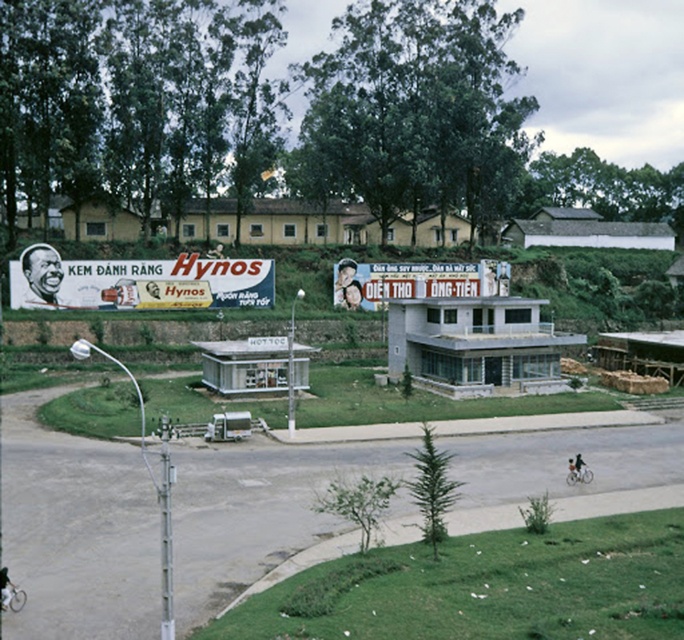
Question: Does matte yellow billboard at left appear under matte plastic billboard at center?

Choices:
 (A) yes
 (B) no

Answer: (A)

Question: Among these objects, which one is nearest to the camera?

Choices:
 (A) matte plastic billboard at center
 (B) matte yellow billboard at left

Answer: (B)

Question: Can you confirm if matte yellow billboard at left is bigger than matte plastic billboard at center?

Choices:
 (A) yes
 (B) no

Answer: (A)

Question: Which point appears farthest from the camera in this image?

Choices:
 (A) (486, 273)
 (B) (222, 262)

Answer: (A)

Question: Is matte yellow billboard at left to the left of matte plastic billboard at center from the viewer's perspective?

Choices:
 (A) yes
 (B) no

Answer: (A)